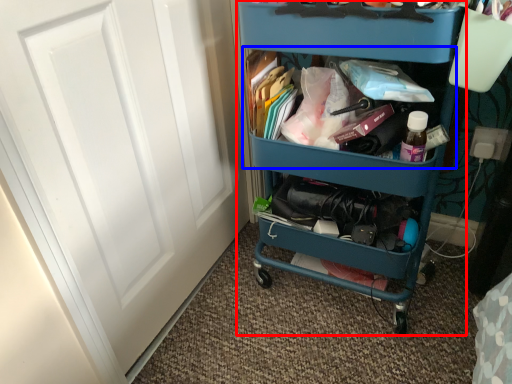
Question: Which object is closer to the camera taking this photo, furniture (highlighted by a red box) or cabinet (highlighted by a blue box)?

Choices:
 (A) furniture
 (B) cabinet

Answer: (A)